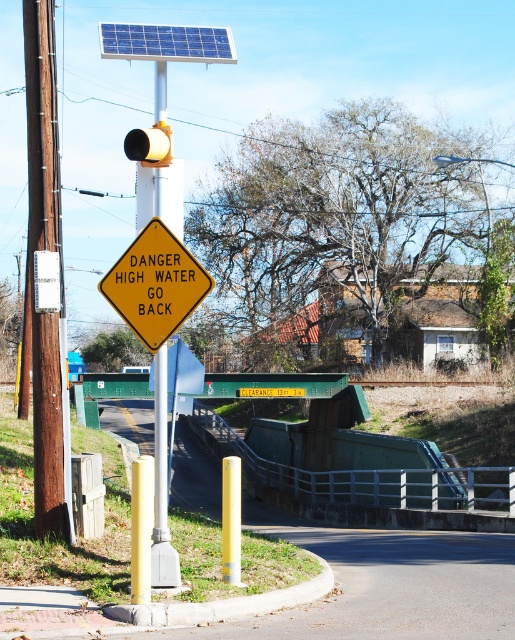
You are a truck driver planning to pass under the blue textured solar panel at upper center. There is a metallic yellow pole at center in your path. Can you safely drive around the pole to avoid hitting the solar panel?

The metallic yellow pole at center is positioned under the blue textured solar panel at upper center, meaning the pole is directly below the solar panel. Since the pole is under the solar panel, you cannot drive around it without risking collision with either the pole or the solar panel. You should consider an alternative route.

You are a delivery driver who needs to know if your truck can pass under the bridge. You see the yellow matte traffic sign at center and the metallic yellow pole at center. Which one takes up more space in the scene?

The metallic yellow pole at center takes up more space in the scene than the yellow matte traffic sign at center.

You are a delivery driver planning to drive under the yellow matte traffic sign at center. Based on the scene description, what is the height clearance of the bridge above this sign?

The small yellow sign on the bridge indicates a clearance height of 13 feet 3 inches.